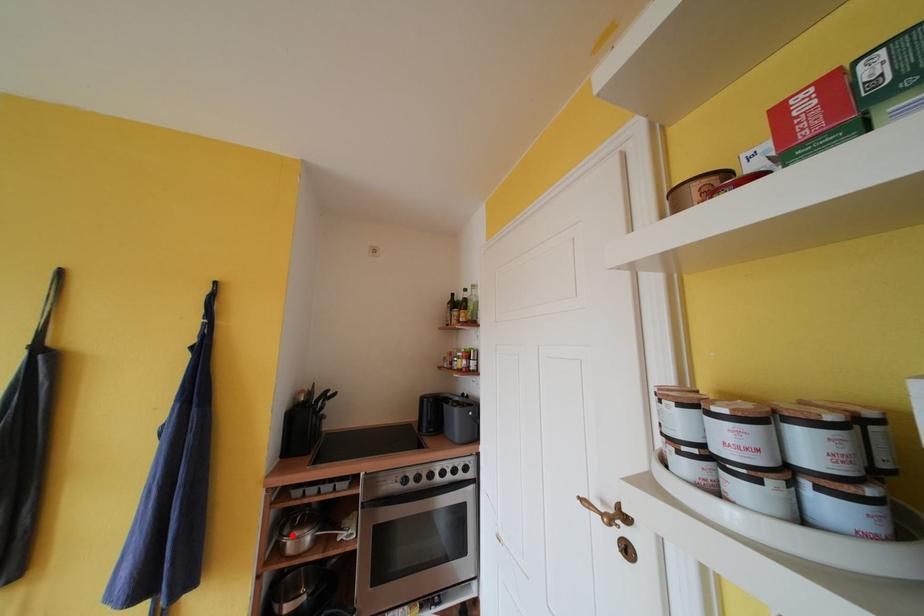
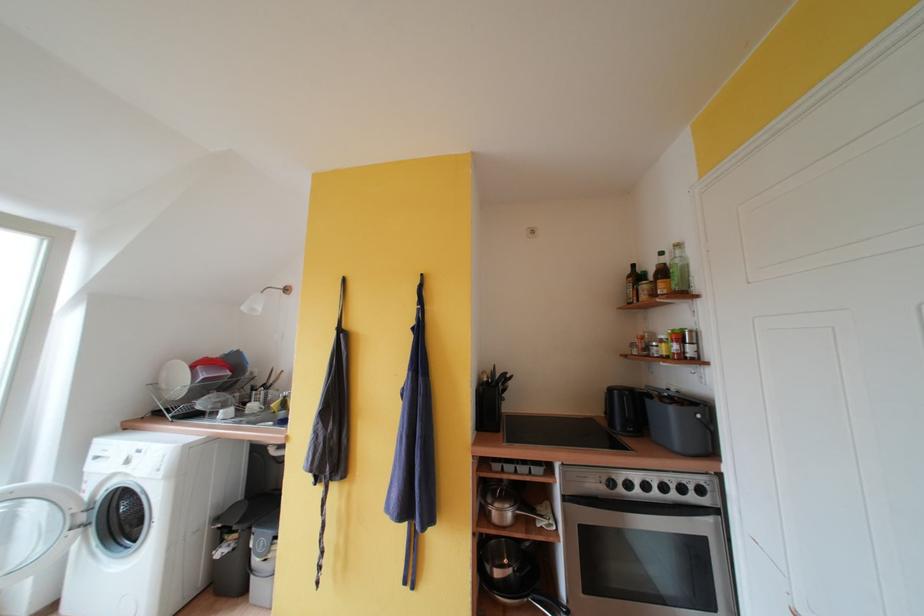
Question: A red point is marked in image1. In image2, is the corresponding 3D point closer to the camera or farther? Reply with the corresponding letter.

Choices:
 (A) The corresponding 3D point is closer.
 (B) The corresponding 3D point is farther.

Answer: (B)